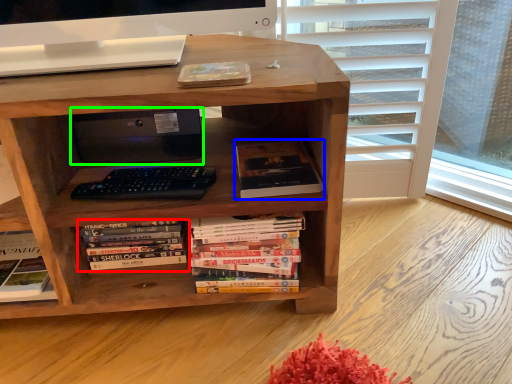
Question: Which object is positioned closest to book (highlighted by a red box)? Select from book (highlighted by a blue box) and computer (highlighted by a green box).

Choices:
 (A) book
 (B) computer

Answer: (B)